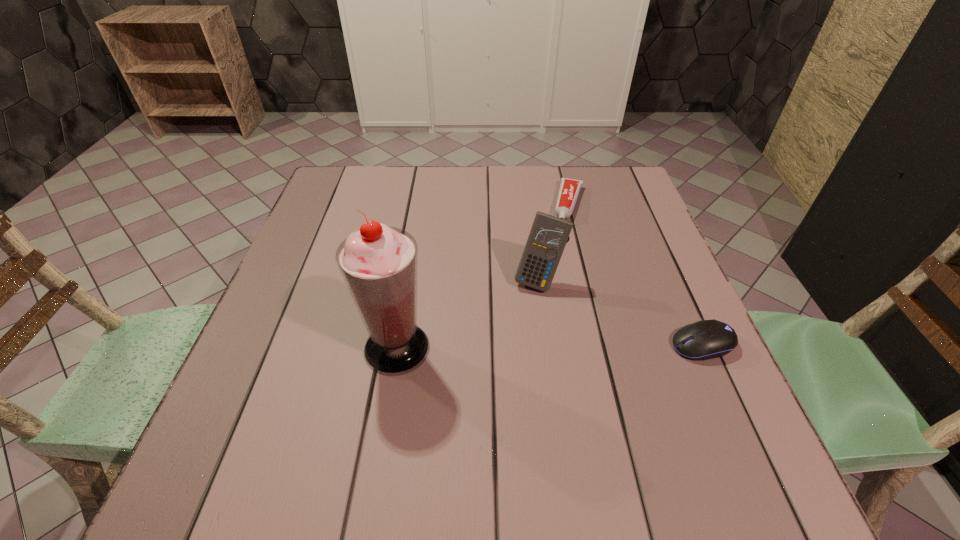
Locate an element on the screen. the leftmost object is located at coordinates (379, 264).

Locate an element on the screen. This screenshot has height=540, width=960. smoothie is located at coordinates (379, 264).

The width and height of the screenshot is (960, 540). What are the coordinates of `computer mouse` in the screenshot? It's located at (707, 339).

Locate an element on the screen. the farthest object is located at coordinates (569, 190).

Find the location of `toothpaste`. toothpaste is located at coordinates (569, 190).

Image resolution: width=960 pixels, height=540 pixels. I want to click on calculator, so click(548, 236).

The width and height of the screenshot is (960, 540). I want to click on the third nearest object, so click(x=548, y=236).

Image resolution: width=960 pixels, height=540 pixels. Find the location of `blank space located 0.100m on the right of the tallest object`. blank space located 0.100m on the right of the tallest object is located at coordinates click(x=480, y=348).

Locate an element on the screen. free spot located on the back of the computer mouse is located at coordinates (668, 268).

At what (x,y) coordinates should I click in order to perform the action: click on blank space located at the nozzle of the farthest object. Please return your answer as a coordinate pair (x, y). The image size is (960, 540). Looking at the image, I should click on click(558, 273).